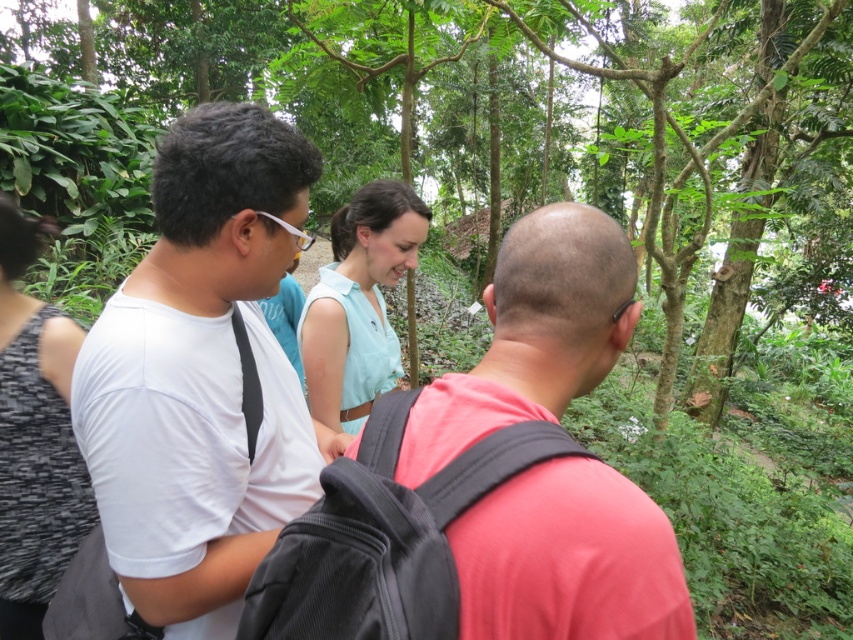
You are part of a hiking group in the forest and need to locate the pink matte shirt at center. Based on the scene, where should you look relative to the green leafy tree at center?

The green leafy tree at center is to the right of the pink matte shirt at center, so you should look to the left side of the green leafy tree at center to find the pink matte shirt at center.